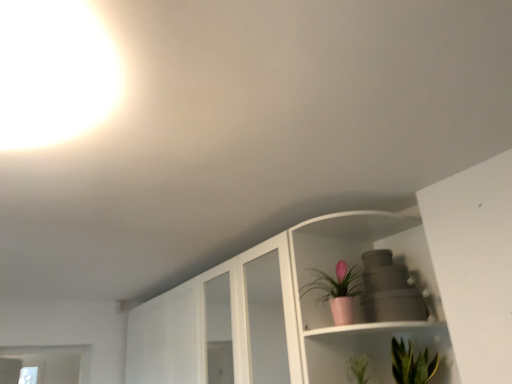
Question: Is pink matte pot at upper center, which is the first houseplant in left-to-right order, spatially inside green leafy plant at lower right, which is the second houseplant in top-to-bottom order, or outside of it?

Choices:
 (A) inside
 (B) outside

Answer: (B)

Question: From a real-world perspective, relative to green leafy plant at lower right, marked as the 1th houseplant in a right-to-left arrangement, is pink matte pot at upper center, the 1th houseplant positioned from the top, vertically above or below?

Choices:
 (A) above
 (B) below

Answer: (A)

Question: Looking at the image, does pink matte pot at upper center, the 1th houseplant positioned from the top, seem bigger or smaller compared to green leafy plant at lower right, the 2th houseplant positioned from the left?

Choices:
 (A) big
 (B) small

Answer: (B)

Question: Considering their positions, is green leafy plant at lower right, which is the 1th houseplant in bottom-to-top order, located in front of or behind pink matte pot at upper center, which is the second houseplant from right to left?

Choices:
 (A) behind
 (B) front

Answer: (B)

Question: From the image's perspective, is green leafy plant at lower right, which is the second houseplant in top-to-bottom order, above or below pink matte pot at upper center, which is the second houseplant from right to left?

Choices:
 (A) above
 (B) below

Answer: (B)

Question: In terms of height, does green leafy plant at lower right, the 2th houseplant positioned from the left, look taller or shorter compared to pink matte pot at upper center, the second houseplant from the bottom?

Choices:
 (A) tall
 (B) short

Answer: (B)

Question: Is green leafy plant at lower right, marked as the 1th houseplant in a right-to-left arrangement, inside or outside of pink matte pot at upper center, which is the first houseplant in left-to-right order?

Choices:
 (A) outside
 (B) inside

Answer: (A)